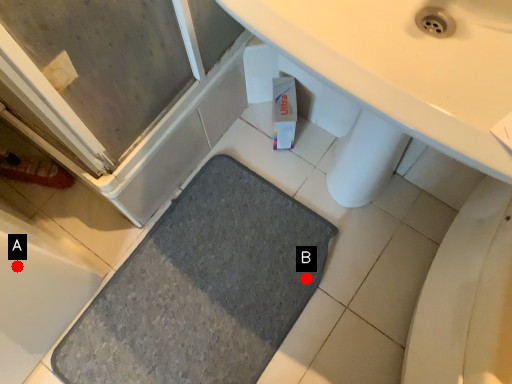
Question: Two points are circled on the image, labeled by A and B beside each circle. Which of the following is the closest to the observer?

Choices:
 (A) A is closer
 (B) B is closer

Answer: (A)